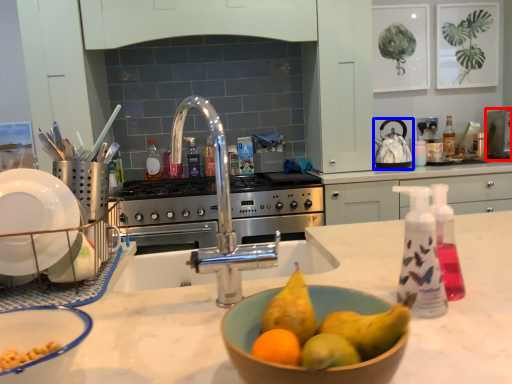
Question: Which object is further to the camera taking this photo, appliance (highlighted by a red box) or kitchen appliance (highlighted by a blue box)?

Choices:
 (A) appliance
 (B) kitchen appliance

Answer: (A)